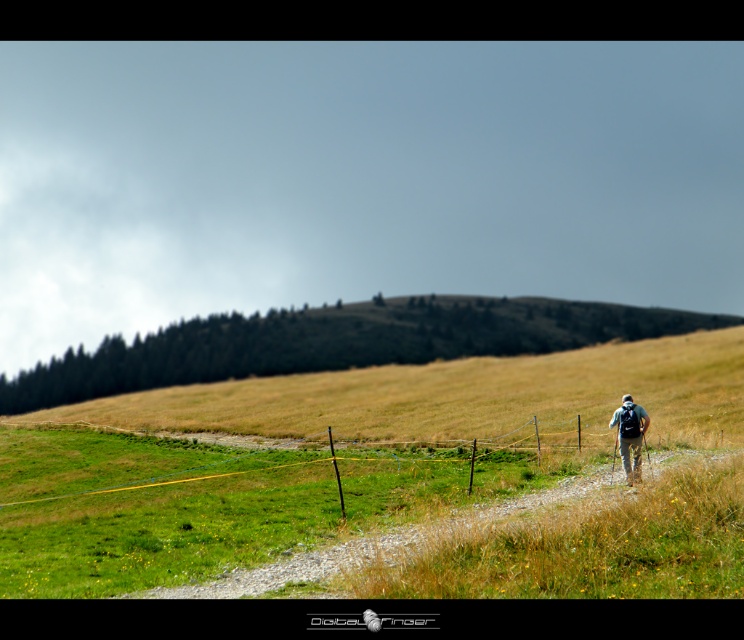
Question: Can you confirm if green grassy hillside at center is smaller than camouflage fabric backpack at right?

Choices:
 (A) yes
 (B) no

Answer: (B)

Question: Does green grass at center have a greater width compared to camouflage fabric backpack at right?

Choices:
 (A) yes
 (B) no

Answer: (A)

Question: Can you confirm if green grass at center is thinner than green grassy hillside at center?

Choices:
 (A) yes
 (B) no

Answer: (A)

Question: Which of these objects is positioned closest to the green grassy hillside at center?

Choices:
 (A) camouflage fabric backpack at right
 (B) green grass at center

Answer: (B)

Question: Which point is closer to the camera?

Choices:
 (A) (186, 374)
 (B) (403, 513)

Answer: (B)

Question: Which point is farther from the camera taking this photo?

Choices:
 (A) (641, 422)
 (B) (240, 326)

Answer: (B)